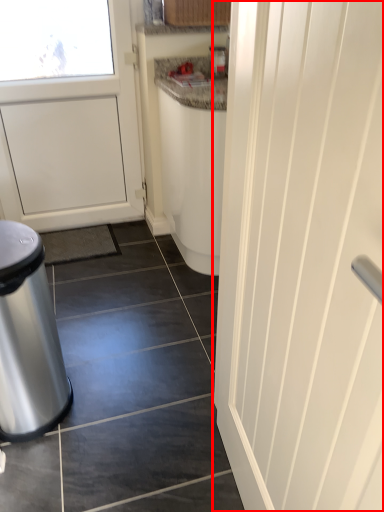
Question: From the image's perspective, what is the correct spatial positioning of door (annotated by the red box) in reference to waste container?

Choices:
 (A) below
 (B) above

Answer: (B)